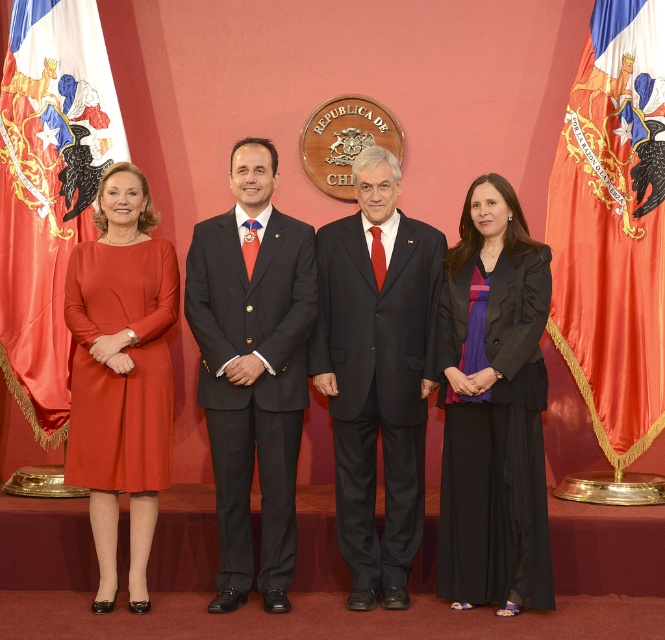
Question: Which object appears closest to the camera in this image?

Choices:
 (A) purple satin blouse at center
 (B) silky red flag at left
 (C) orange silk flag at upper right
 (D) matte black suit at center

Answer: (A)

Question: Considering the relative positions of purple satin blouse at center and matte black suit at center in the image provided, where is purple satin blouse at center located with respect to matte black suit at center?

Choices:
 (A) below
 (B) above

Answer: (A)

Question: Which is farther from the matte black suit at center?

Choices:
 (A) matte orange dress at left
 (B) black satin suit at center
 (C) purple satin blouse at center
 (D) orange silk flag at upper right

Answer: (D)

Question: Does purple satin blouse at center appear over matte orange dress at left?

Choices:
 (A) no
 (B) yes

Answer: (A)

Question: Does purple satin blouse at center have a smaller size compared to matte black suit at center?

Choices:
 (A) yes
 (B) no

Answer: (B)

Question: Which point is closer to the camera?

Choices:
 (A) orange silk flag at upper right
 (B) purple satin blouse at center

Answer: (B)